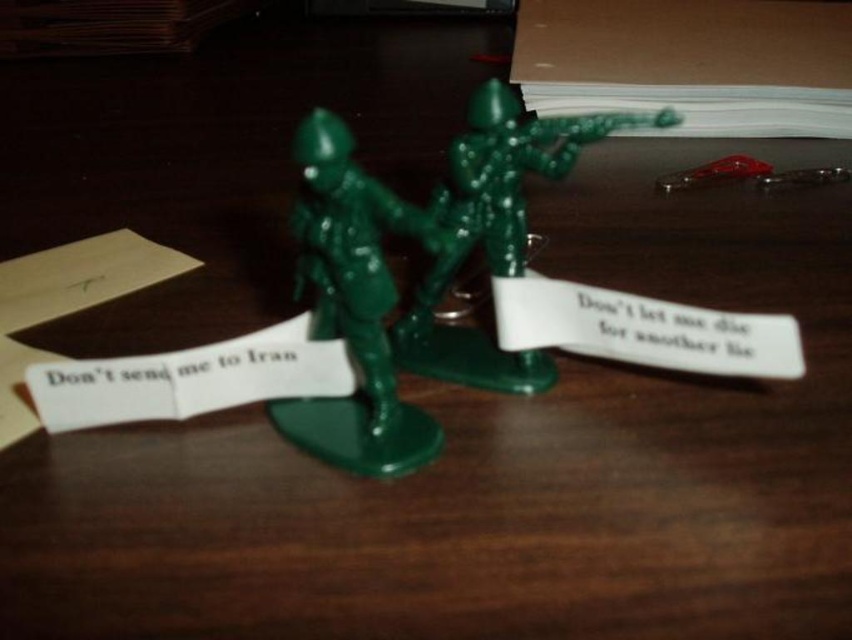
Is green plastic toy soldiers at center to the right of green plastic toy soldier at center from the viewer's perspective?

In fact, green plastic toy soldiers at center is to the left of green plastic toy soldier at center.

Does green plastic toy soldiers at center appear over green plastic toy soldier at center?

No.

Does point (315, 198) come closer to viewer compared to point (486, 230)?

Yes, point (315, 198) is in front of point (486, 230).

You are a GUI agent. You are given a task and a screenshot of the screen. Output one action in this format:
    pyautogui.click(x=<x>, y=<y>)
    Task: Click on the green plastic toy soldiers at center
    
    Given the screenshot: What is the action you would take?
    pyautogui.click(x=352, y=307)